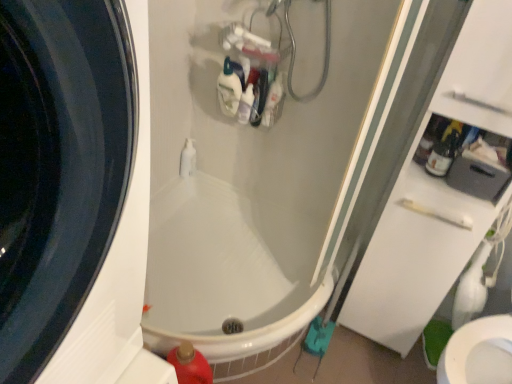
Question: Is there a large distance between white glossy bottle at upper center, positioned as the second cleaning product in back-to-front order, and translucent plastic bottle at upper center, the first cleaning product in the back-to-front sequence?

Choices:
 (A) yes
 (B) no

Answer: (B)

Question: From a real-world perspective, is white glossy bottle at upper center, positioned as the second cleaning product in back-to-front order, under translucent plastic bottle at upper center, which appears as the 1th cleaning product when viewed from the top?

Choices:
 (A) yes
 (B) no

Answer: (A)

Question: Is white glossy bottle at upper center, positioned as the second cleaning product in back-to-front order, taller than translucent plastic bottle at upper center, the first cleaning product in the back-to-front sequence?

Choices:
 (A) no
 (B) yes

Answer: (A)

Question: Is translucent plastic bottle at upper center, which is the 3th cleaning product in front-to-back order, located within white glossy bottle at upper center, positioned as the second cleaning product in back-to-front order?

Choices:
 (A) no
 (B) yes

Answer: (A)

Question: From the image's perspective, would you say white glossy bottle at upper center, the 2th cleaning product in the bottom-to-top sequence, is positioned over translucent plastic bottle at upper center, which is the 3th cleaning product in front-to-back order?

Choices:
 (A) yes
 (B) no

Answer: (B)

Question: Is white glossy bathtub at center taller or shorter than red plastic bottle at lower left, which ranks as the third cleaning product in top-to-bottom order?

Choices:
 (A) short
 (B) tall

Answer: (A)

Question: Is white glossy bathtub at center spatially inside red plastic bottle at lower left, which ranks as the third cleaning product in top-to-bottom order, or outside of it?

Choices:
 (A) outside
 (B) inside

Answer: (A)

Question: Looking at the image, does white glossy bathtub at center seem bigger or smaller compared to red plastic bottle at lower left, the 3th cleaning product in the back-to-front sequence?

Choices:
 (A) small
 (B) big

Answer: (B)

Question: In the image, is white glossy bathtub at center positioned in front of or behind red plastic bottle at lower left, the 3th cleaning product in the back-to-front sequence?

Choices:
 (A) front
 (B) behind

Answer: (A)

Question: Is red plastic bottle at lower left, which ranks as the third cleaning product in top-to-bottom order, situated inside white glossy pump bottle at center or outside?

Choices:
 (A) inside
 (B) outside

Answer: (B)

Question: Looking at their shapes, would you say red plastic bottle at lower left, the 3th cleaning product in the back-to-front sequence, is wider or thinner than white glossy pump bottle at center?

Choices:
 (A) wide
 (B) thin

Answer: (A)

Question: From a real-world perspective, relative to white glossy pump bottle at center, is red plastic bottle at lower left, acting as the first cleaning product starting from the front, vertically above or below?

Choices:
 (A) above
 (B) below

Answer: (B)

Question: Is red plastic bottle at lower left, the 3th cleaning product in the back-to-front sequence, bigger or smaller than white glossy pump bottle at center?

Choices:
 (A) big
 (B) small

Answer: (A)

Question: From a real-world perspective, is red plastic bottle at lower left, which ranks as the third cleaning product in top-to-bottom order, positioned above or below white glossy bathtub at center?

Choices:
 (A) below
 (B) above

Answer: (B)

Question: Looking at the image, does red plastic bottle at lower left, which ranks as the third cleaning product in top-to-bottom order, seem bigger or smaller compared to white glossy bathtub at center?

Choices:
 (A) small
 (B) big

Answer: (A)